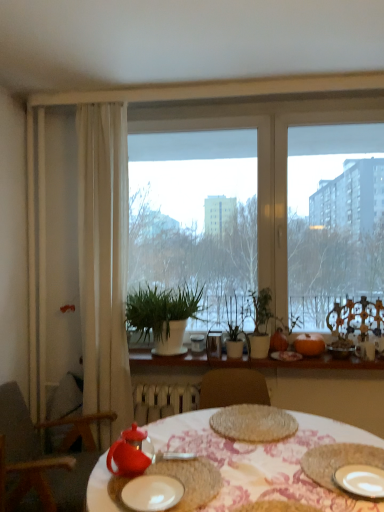
Find the location of a particular element. The image size is (384, 512). free space above white sheer curtain at left (from a real-world perspective) is located at coordinates (102, 89).